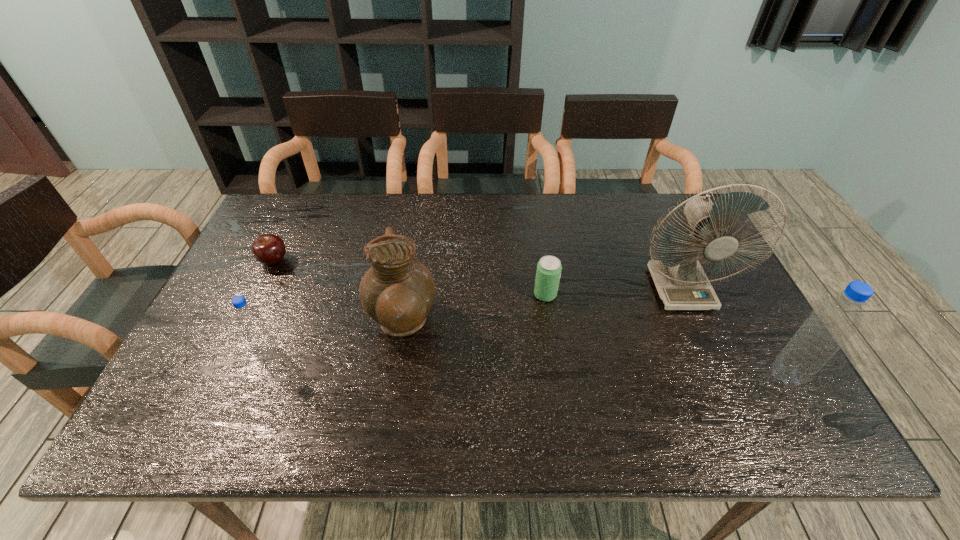
Where is `free space in the image that satisfies the following two spatial constraints: 1. on the back side of the fourth tallest object; 2. on the right side of the fifth tallest object`? The height and width of the screenshot is (540, 960). free space in the image that satisfies the following two spatial constraints: 1. on the back side of the fourth tallest object; 2. on the right side of the fifth tallest object is located at coordinates (293, 295).

Where is `free space in the image that satisfies the following two spatial constraints: 1. on the back side of the fifth tallest object; 2. on the left side of the left water bottle`? The height and width of the screenshot is (540, 960). free space in the image that satisfies the following two spatial constraints: 1. on the back side of the fifth tallest object; 2. on the left side of the left water bottle is located at coordinates pyautogui.click(x=293, y=295).

The width and height of the screenshot is (960, 540). I want to click on free space that satisfies the following two spatial constraints: 1. on the front side of the soda; 2. at the spout of the third object from left to right, so click(549, 325).

Find the location of a particular element. This screenshot has height=540, width=960. vacant space that satisfies the following two spatial constraints: 1. on the front-facing side of the right water bottle; 2. on the right side of the fan is located at coordinates (719, 376).